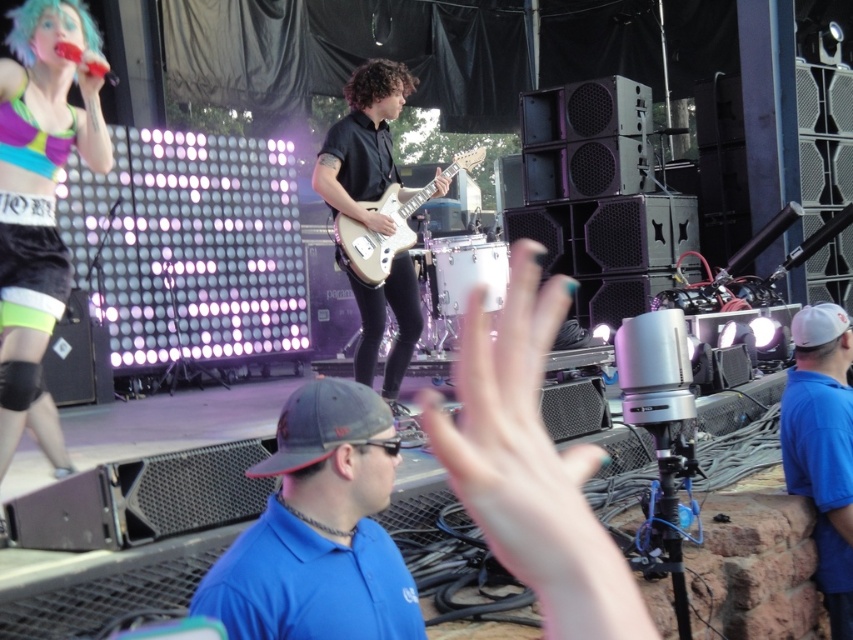
You are a photographer at the concert and want to capture both the blue cotton shirt at right and the white glossy electric guitar at center in the same frame. Which object should you focus on first to ensure both are in the frame?

The blue cotton shirt at right is thinner than the white glossy electric guitar at center, so you should focus on the white glossy electric guitar at center first to ensure both are in the frame.

Looking at this image, you are standing at the point marked as point (0,328). The stage has two musicians. How far apart are the two musicians from each other?

The two musicians are 3.37 meters apart from each other.

You are a photographer at the concert. You want to take a photo that includes both the matte black shorts at left and the matte white guitar at center. Which object should you zoom in on to ensure both are visible in the frame?

Since the matte black shorts at left is smaller than the matte white guitar at center, you should zoom in on the matte white guitar at center to ensure both objects fit within the frame.